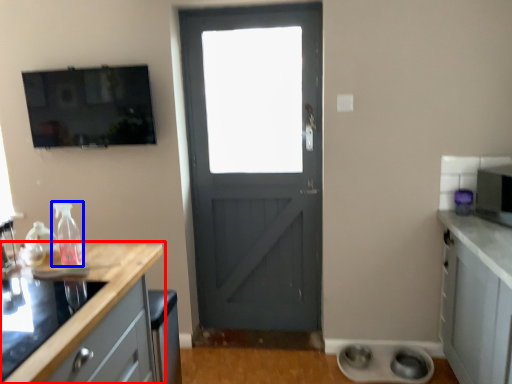
Question: Which object is closer to the camera taking this photo, countertop (highlighted by a red box) or bottle (highlighted by a blue box)?

Choices:
 (A) countertop
 (B) bottle

Answer: (A)